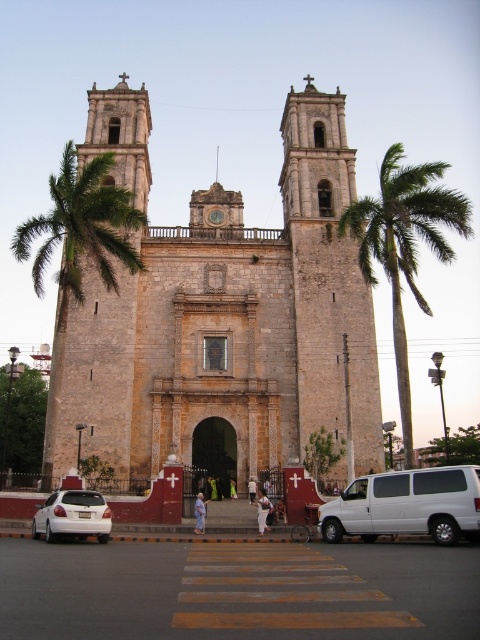
Does green leafy palm tree at center appear on the right side of white matte van at center?

Yes, green leafy palm tree at center is to the right of white matte van at center.

At what (x,y) coordinates should I click in order to perform the action: click on green leafy palm tree at center. Please return your answer as a coordinate pair (x, y). This screenshot has height=640, width=480. Looking at the image, I should click on (405, 244).

Can you confirm if white matte van at center is shorter than white matte sedan at lower left?

No.

Consider the image. Which is below, white matte van at center or white matte sedan at lower left?

white matte sedan at lower left is below.

You are a GUI agent. You are given a task and a screenshot of the screen. Output one action in this format:
    pyautogui.click(x=<x>, y=<y>)
    Task: Click on the white matte van at center
    This screenshot has width=480, height=640.
    Given the screenshot: What is the action you would take?
    pyautogui.click(x=407, y=506)

Where is `stone church at center`? The width and height of the screenshot is (480, 640). stone church at center is located at coordinates (232, 324).

Does point (156, 460) lie in front of point (317, 316)?

Yes.

I want to click on stone church at center, so click(232, 324).